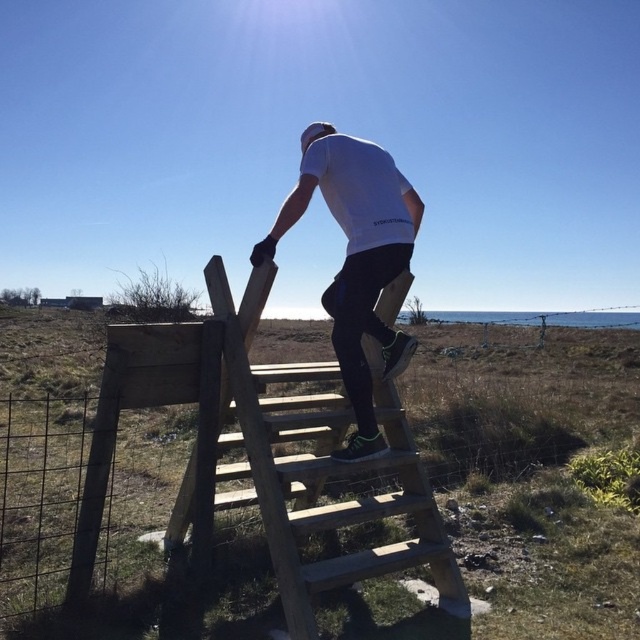
Which is behind, point (298, 592) or point (356, 163)?

The point (356, 163) is more distant.

Does wooden stairs at center appear over white matte shirt at upper center?

Actually, wooden stairs at center is below white matte shirt at upper center.

Who is more distant from viewer, (336, 426) or (385, 269)?

Point (336, 426)

At what (x,y) coordinates should I click in order to perform the action: click on wooden stairs at center. Please return your answer as a coordinate pair (x, y). This screenshot has height=640, width=640. Looking at the image, I should click on (317, 465).